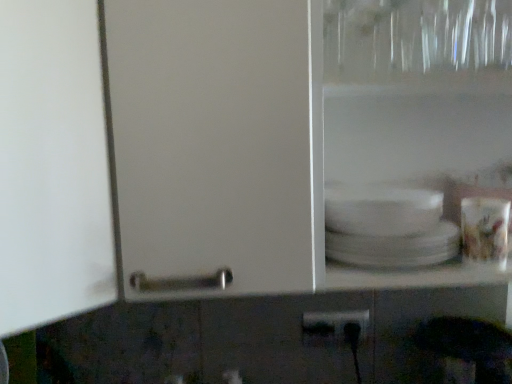
Question: Considering the positions of matte ceramic cup at right and black plastic power plugs and sockets at lower center in the image, is matte ceramic cup at right wider or thinner than black plastic power plugs and sockets at lower center?

Choices:
 (A) wide
 (B) thin

Answer: (A)

Question: From the image's perspective, is matte ceramic cup at right positioned above or below black plastic power plugs and sockets at lower center?

Choices:
 (A) above
 (B) below

Answer: (A)

Question: Is point (501, 261) positioned closer to the camera than point (368, 326)?

Choices:
 (A) farther
 (B) closer

Answer: (B)

Question: Is black plastic power plugs and sockets at lower center wider or thinner than matte ceramic cup at right?

Choices:
 (A) wide
 (B) thin

Answer: (B)

Question: Would you say black plastic power plugs and sockets at lower center is inside or outside matte ceramic cup at right?

Choices:
 (A) outside
 (B) inside

Answer: (A)

Question: From the image's perspective, is black plastic power plugs and sockets at lower center positioned above or below matte ceramic cup at right?

Choices:
 (A) below
 (B) above

Answer: (A)

Question: In terms of height, does black plastic power plugs and sockets at lower center look taller or shorter compared to matte ceramic cup at right?

Choices:
 (A) short
 (B) tall

Answer: (A)